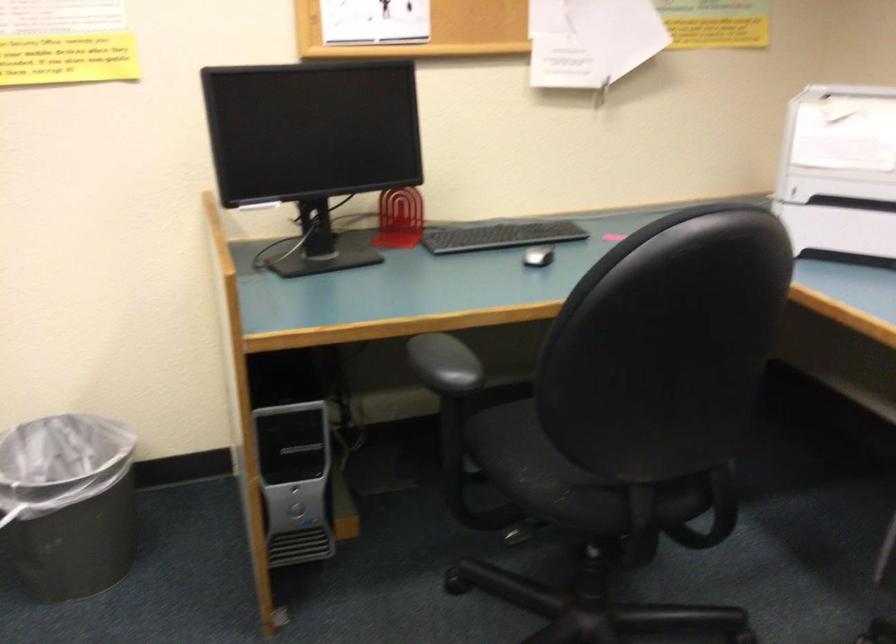
Find the location of a particular element. The height and width of the screenshot is (644, 896). PC power button is located at coordinates point(297,509).